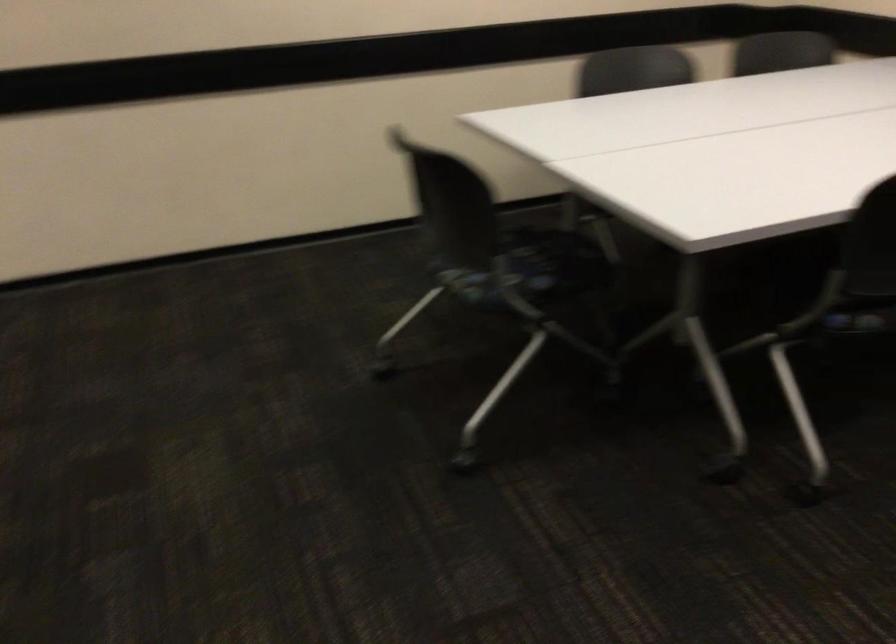
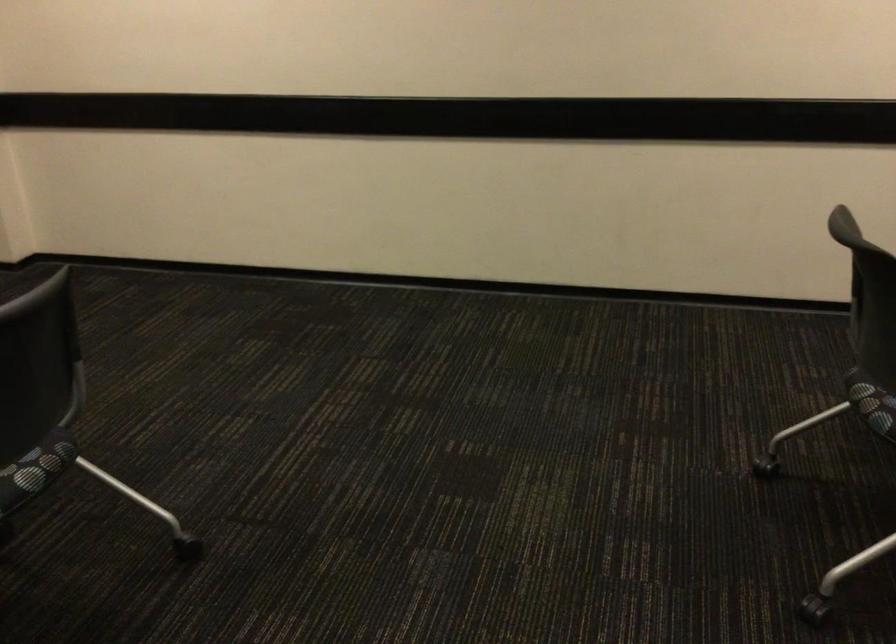
Question: The images are taken continuously from a first-person perspective. In which direction is your viewpoint rotating?

Choices:
 (A) Left
 (B) Right
 (C) Up
 (D) Down

Answer: (A)